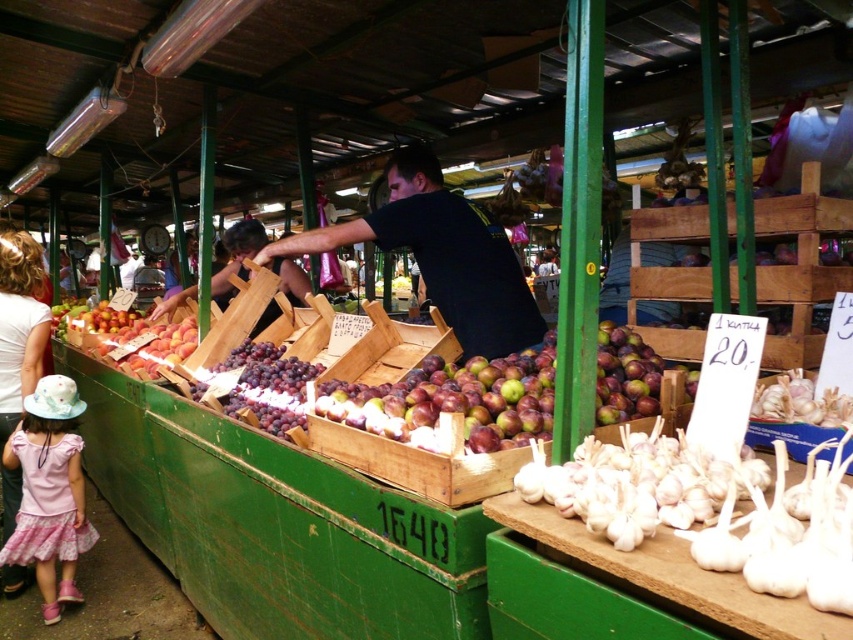
Consider the image. You are a customer at the market and want to reach both the plums and the peaches displayed in wooden crates. The plums are located at point (78, 483) and the peaches at point (0, 340). Which of these points is closer to you as you approach the stall?

Point (78, 483) is in front of point (0, 340), so the plums at point (78, 483) are closer to you as you approach the stall.

Looking at this image, you are a customer at the market and want to approach the stall. There are two people in your way. One is wearing a pink floral dress at lower left and the other a white cotton shirt at left. Which person do you need to go around to reach the stall first?

The pink floral dress at lower left is in front of the white cotton shirt at left, so you need to go around the pink floral dress at lower left first to reach the stall.

You are a customer at the market and want to approach the stall. You see the black matte shirt at center and the pink floral dress at lower left. Which person should you approach first if you want to reach the stall owner?

The black matte shirt at center is closer to the viewer than the pink floral dress at lower left, so you should approach the person wearing the black matte shirt at center first as they are nearer to you.